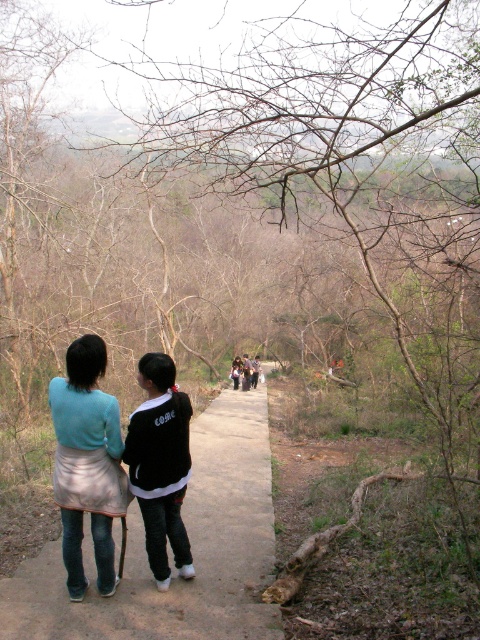
The height and width of the screenshot is (640, 480). Describe the element at coordinates (170, 552) in the screenshot. I see `brown concrete path at center` at that location.

What do you see at coordinates (170, 552) in the screenshot?
I see `brown concrete path at center` at bounding box center [170, 552].

The width and height of the screenshot is (480, 640). Find the location of `brown concrete path at center`. brown concrete path at center is located at coordinates (170, 552).

Who is more forward, (62, 509) or (162, 502)?

Point (62, 509)

Who is more distant from viewer, (75, 358) or (170, 404)?

Positioned behind is point (170, 404).

I want to click on light blue fabric skirt at center, so click(86, 461).

Does brown concrete path at center have a lesser height compared to black cotton jacket at center?

Indeed, brown concrete path at center has a lesser height compared to black cotton jacket at center.

The height and width of the screenshot is (640, 480). Describe the element at coordinates (170, 552) in the screenshot. I see `brown concrete path at center` at that location.

Find the location of a particular element. brown concrete path at center is located at coordinates (170, 552).